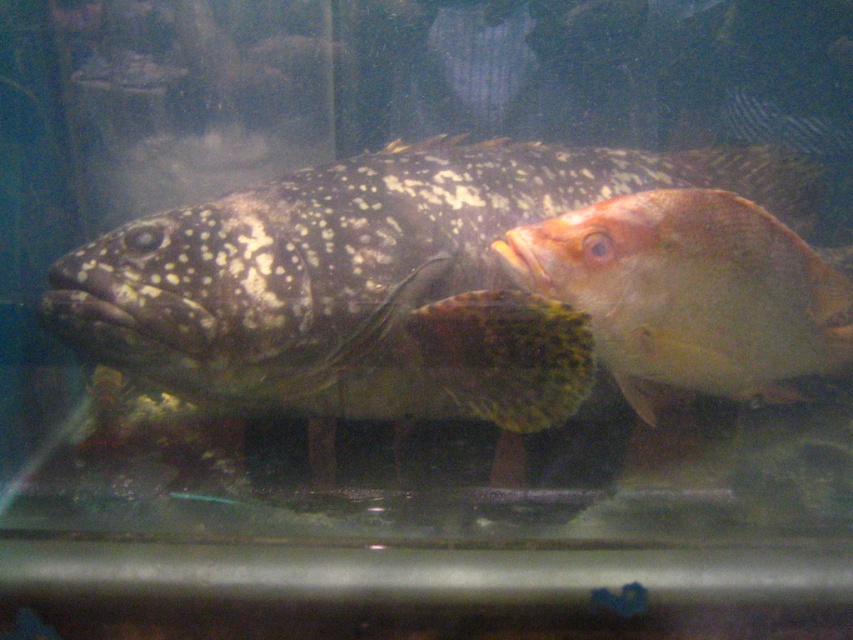
You are an aquarium keeper trying to locate the speckled matte fish at center in the image. The coordinates provided are point (364, 285). Based on the scene description, can you confirm if this point is indeed where the speckled matte fish at center is located?

Yes, the point (364, 285) marks the location of the speckled matte fish at center as per the Objects Description.

You are standing in front of an aquarium and see two points marked on the glass. The first point is at point [68,312] and the second is at point [737,230]. Which point is closer to you?

Point [68,312] is closer to you because it is further to the viewer than point [737,230].